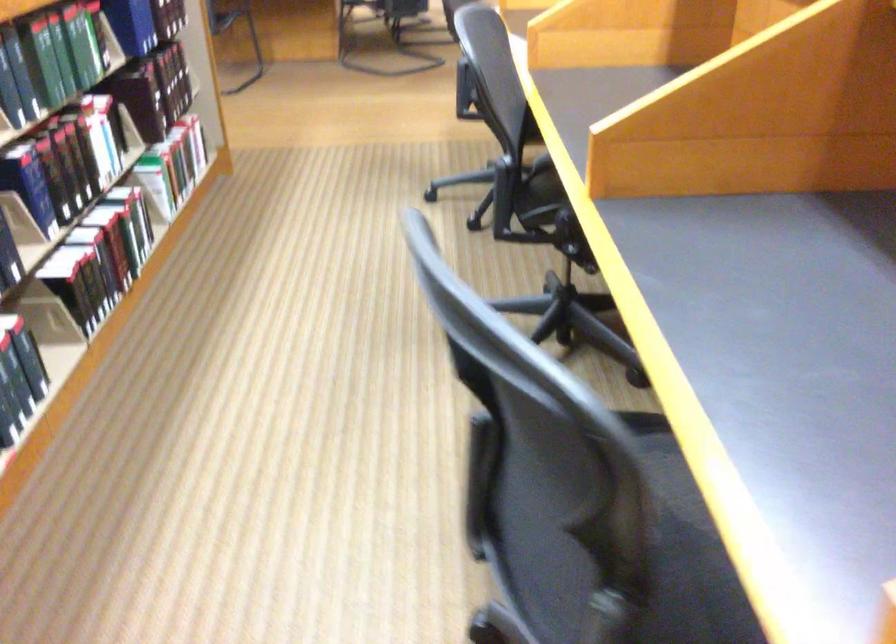
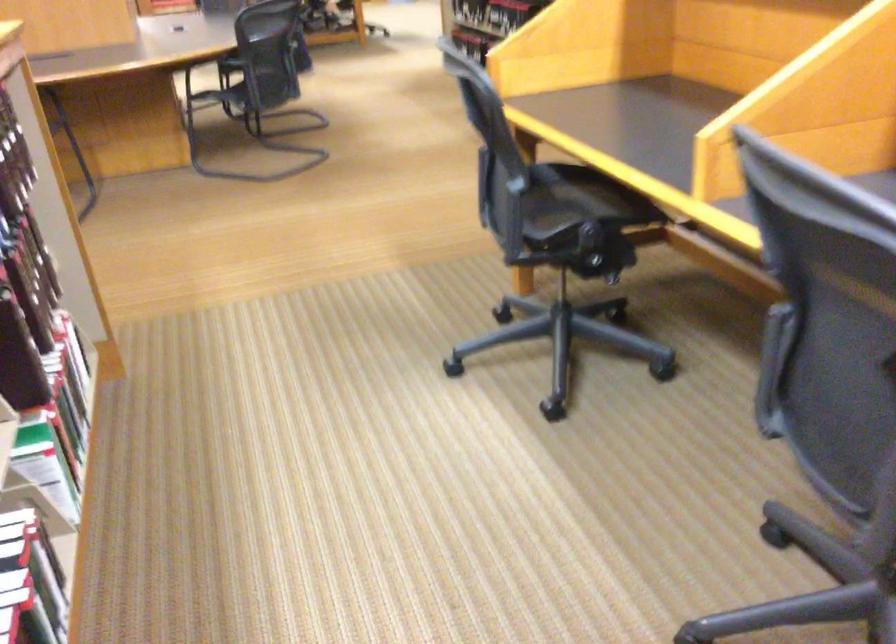
Locate, in the second image, the point that corresponds to point 515,138 in the first image.

(830, 341)